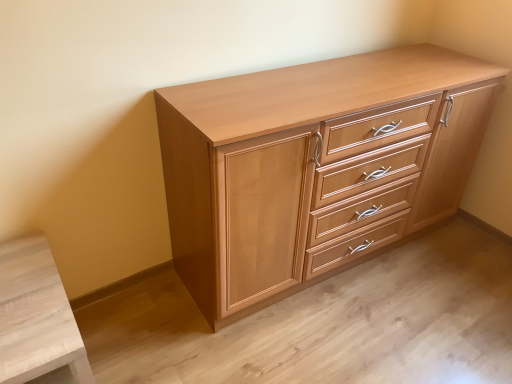
You are a GUI agent. You are given a task and a screenshot of the screen. Output one action in this format:
    pyautogui.click(x=<x>, y=<y>)
    Task: Click on the vacant space that is in between light wood cabinet at lower left and light brown wood chest of drawers at center
    The image size is (512, 384).
    Given the screenshot: What is the action you would take?
    pyautogui.click(x=182, y=327)